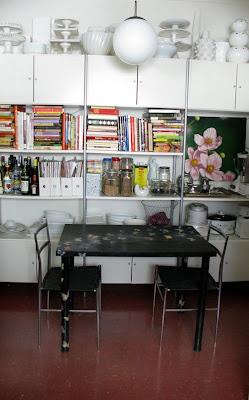
What are the coordinates of `cake and desert display trays` in the screenshot? It's located at (65, 21), (65, 34), (64, 45), (9, 35), (177, 30).